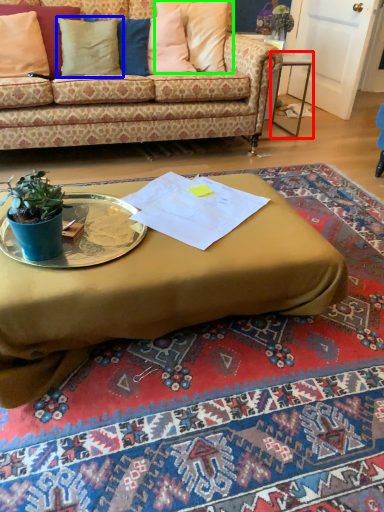
Question: Estimate the real-world distances between objects in this image. Which object is closer to table (highlighted by a red box), pillow (highlighted by a blue box) or pillow (highlighted by a green box)?

Choices:
 (A) pillow
 (B) pillow

Answer: (B)